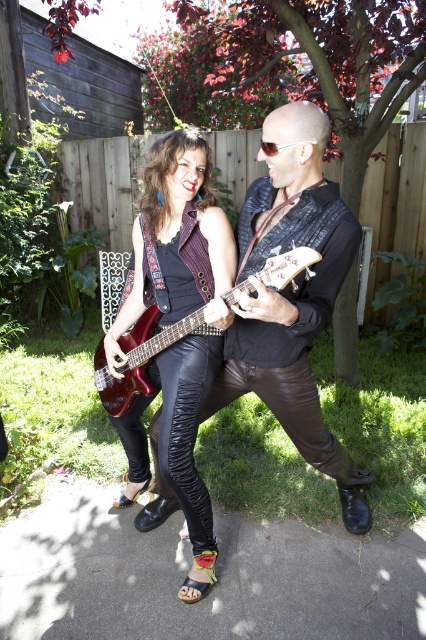
You are standing in the backyard and see two points marked in the image. Which point, point [307,410] or point [157,353], is closer to you?

Point [307,410] is closer to the viewer than point [157,353].

You are a photographer standing in the garden and want to take a closeup photo of the shiny black guitar at center. Considering your current position, do you think you need to move closer or farther away to get a better closeup shot?

The shiny black guitar at center is 5.45 feet away from the viewer. To take a closeup photo, you would need to move closer to the guitar since it is currently more than 5 feet away.

You are a photographer setting up a shot of the two performers. You want to ensure that both the shiny black leather pants at center and the metallic red electric guitar at center are clearly visible in the frame. Based on their sizes, which object should you focus on first to ensure proper focus?

The shiny black leather pants at center is narrower than the metallic red electric guitar at center, so you should focus on the metallic red electric guitar at center first since it is wider and requires more precise focus to capture its details.